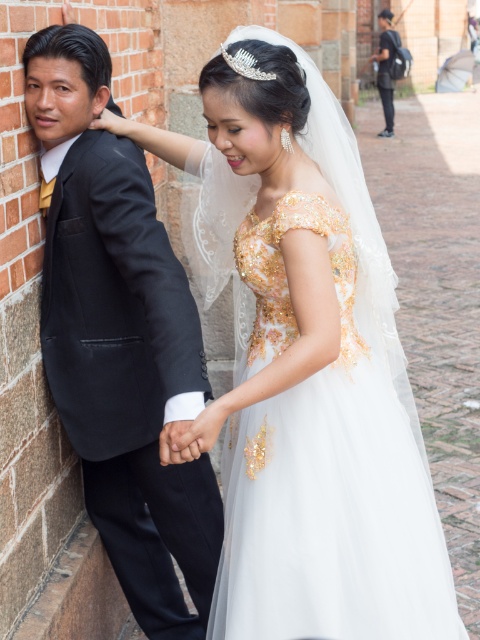
Between point (155, 522) and point (389, 109), which one is positioned behind?

The point (389, 109) is behind.

Does matte black suit at left appear on the left side of dark blue jeans at upper right?

Correct, you'll find matte black suit at left to the left of dark blue jeans at upper right.

This screenshot has width=480, height=640. Describe the element at coordinates (120, 340) in the screenshot. I see `matte black suit at left` at that location.

Locate an element on the screen. matte black suit at left is located at coordinates (120, 340).

Does white tulle dress at center appear on the right side of matte black suit at left?

Correct, you'll find white tulle dress at center to the right of matte black suit at left.

Can you confirm if white tulle dress at center is wider than matte black suit at left?

Correct, the width of white tulle dress at center exceeds that of matte black suit at left.

Which is in front, point (372, 458) or point (157, 604)?

Point (372, 458)

Where is `white tulle dress at center`? The width and height of the screenshot is (480, 640). white tulle dress at center is located at coordinates (324, 470).

Who is more distant from viewer, [257,548] or [377,83]?

The point [377,83] is more distant.

You are a GUI agent. You are given a task and a screenshot of the screen. Output one action in this format:
    pyautogui.click(x=<x>, y=<y>)
    Task: Click on the white tulle dress at center
    Image resolution: width=480 pixels, height=640 pixels.
    Given the screenshot: What is the action you would take?
    pyautogui.click(x=324, y=470)